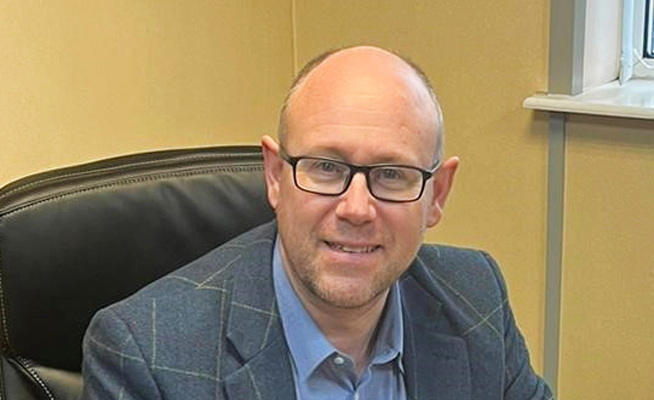
You are a GUI agent. You are given a task and a screenshot of the screen. Output one action in this format:
    pyautogui.click(x=<x>, y=<y>)
    Task: Click on the back of leather computer chair
    
    Given the screenshot: What is the action you would take?
    pyautogui.click(x=165, y=235)